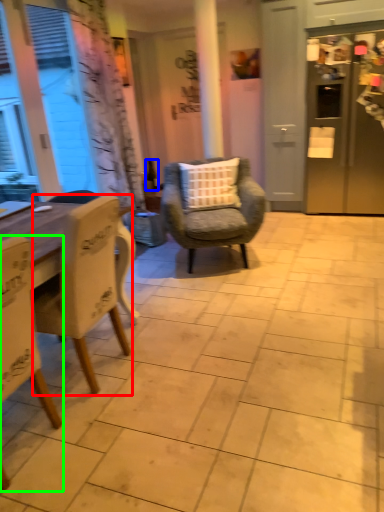
Question: Based on their relative distances, which object is farther from chair (highlighted by a red box)? Choose from bottle (highlighted by a blue box) and chair (highlighted by a green box).

Choices:
 (A) bottle
 (B) chair

Answer: (A)